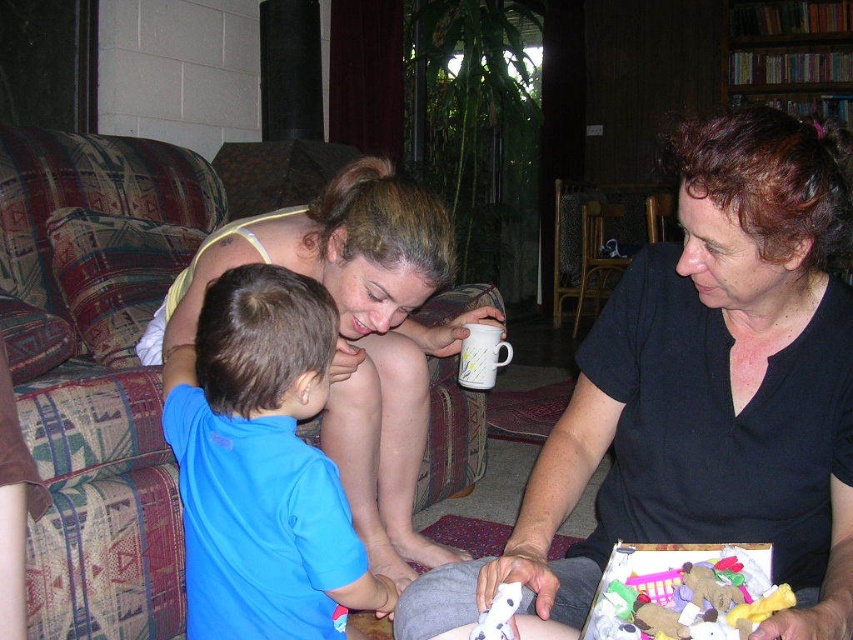
Looking at this image, you are a guest in this living room and want to place a small gift on the table between the black matte shirt at lower right and the white ceramic mug at center. Can you fit it there?

The black matte shirt at lower right is positioned on the right side of white ceramic mug at center, so there is space between them to place the small gift.

You are a tailor who needs to determine if a new button will fit on the matte black shirt at center. The button is the same size as the white plastic toy at lower center. Will it fit?

The matte black shirt at center is wider than the white plastic toy at lower center, so the button will fit on the matte black shirt at center since the shirt is wider than the toy.

You are a delivery robot with a package that needs to be placed between the matte black shirt at center and the white plastic toy at lower center. The robot requires a minimum of 80 centimeters of space to maneuver safely. Can you safely place the package in that area?

The distance between the matte black shirt at center and the white plastic toy at lower center is 75.66 centimeters, which is less than the required 80 centimeters. Therefore, the robot cannot safely maneuver to place the package there.